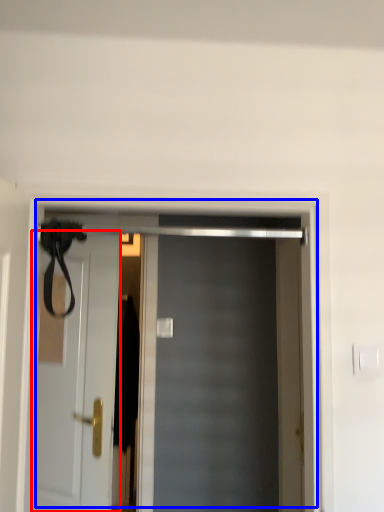
Question: Which of the following is the farthest to the observer, door (highlighted by a red box) or door (highlighted by a blue box)?

Choices:
 (A) door
 (B) door

Answer: (A)